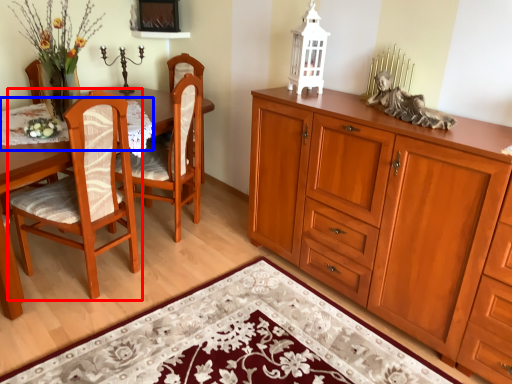
Question: Which object is further to the camera taking this photo, chair (highlighted by a red box) or tablecloth (highlighted by a blue box)?

Choices:
 (A) chair
 (B) tablecloth

Answer: (B)